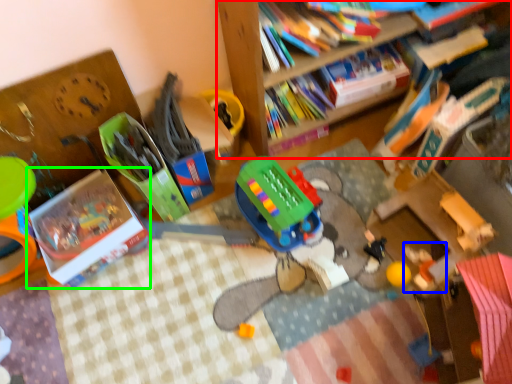
Question: Which object is the closest to the bookcase (highlighted by a red box)? Choose among these: toy (highlighted by a blue box) or book (highlighted by a green box).

Choices:
 (A) toy
 (B) book

Answer: (A)